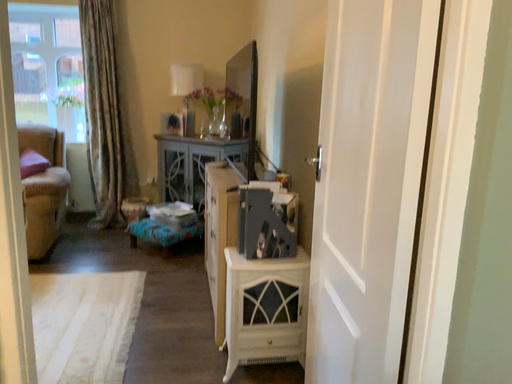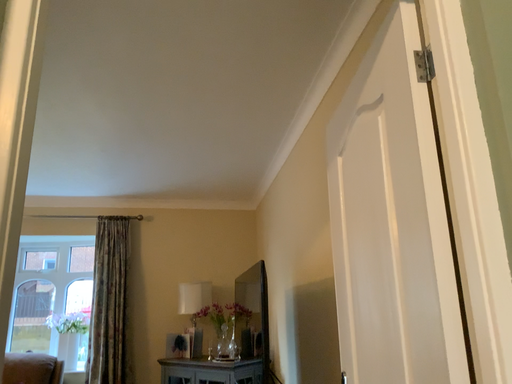
Question: How did the camera likely rotate when shooting the video?

Choices:
 (A) rotated upward
 (B) rotated downward

Answer: (A)